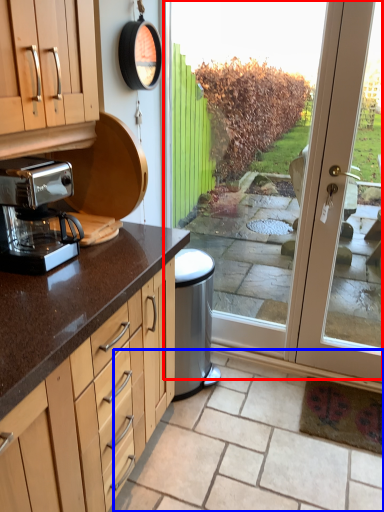
Question: Among these objects, which one is farthest to the camera, screen door (highlighted by a red box) or tile (highlighted by a blue box)?

Choices:
 (A) screen door
 (B) tile

Answer: (A)